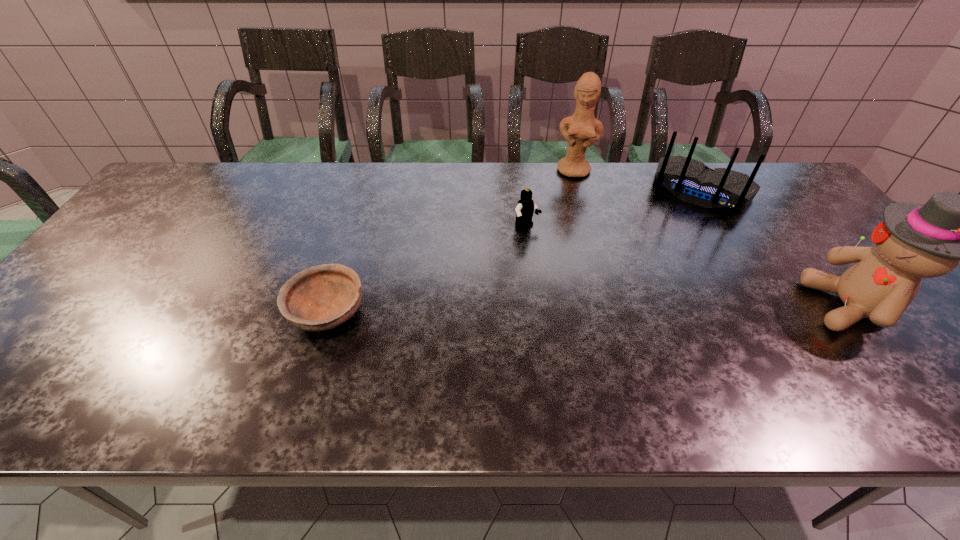
The height and width of the screenshot is (540, 960). I want to click on vacant space positioned 0.140m on the front-facing side of the rag_doll, so click(749, 306).

Where is `vacant space located on the front-facing side of the Lego`? Image resolution: width=960 pixels, height=540 pixels. vacant space located on the front-facing side of the Lego is located at coordinates (550, 246).

Identify the location of vacant region located 0.270m on the front-facing side of the Lego. (609, 292).

Locate an element on the screen. Image resolution: width=960 pixels, height=540 pixels. vacant area situated 0.190m on the front-facing side of the Lego is located at coordinates (x=585, y=273).

You are a GUI agent. You are given a task and a screenshot of the screen. Output one action in this format:
    pyautogui.click(x=<x>, y=<y>)
    Task: Click on the vacant space located on the front-facing side of the third object from right to left
    This screenshot has height=540, width=960.
    Given the screenshot: What is the action you would take?
    pyautogui.click(x=566, y=238)

The width and height of the screenshot is (960, 540). I want to click on vacant space located 0.050m on the front-facing side of the third object from right to left, so click(572, 188).

This screenshot has width=960, height=540. What are the coordinates of `free space located on the front-facing side of the third object from right to left` in the screenshot? It's located at (564, 249).

I want to click on vacant space located on the back of the third tallest object, so click(660, 267).

Where is `vacant space located 0.190m on the back of the third tallest object`? This screenshot has height=540, width=960. vacant space located 0.190m on the back of the third tallest object is located at coordinates (668, 252).

The height and width of the screenshot is (540, 960). What are the coordinates of `vacant space located 0.120m on the back of the third tallest object` in the screenshot? It's located at (675, 238).